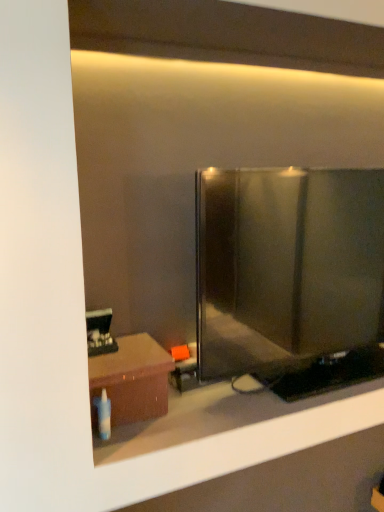
At what (x,y) coordinates should I click in order to perform the action: click on vacant area that is situated to the right of brown matte table at lower left. Please return your answer as a coordinate pair (x, y). This screenshot has width=384, height=512. Looking at the image, I should click on (202, 411).